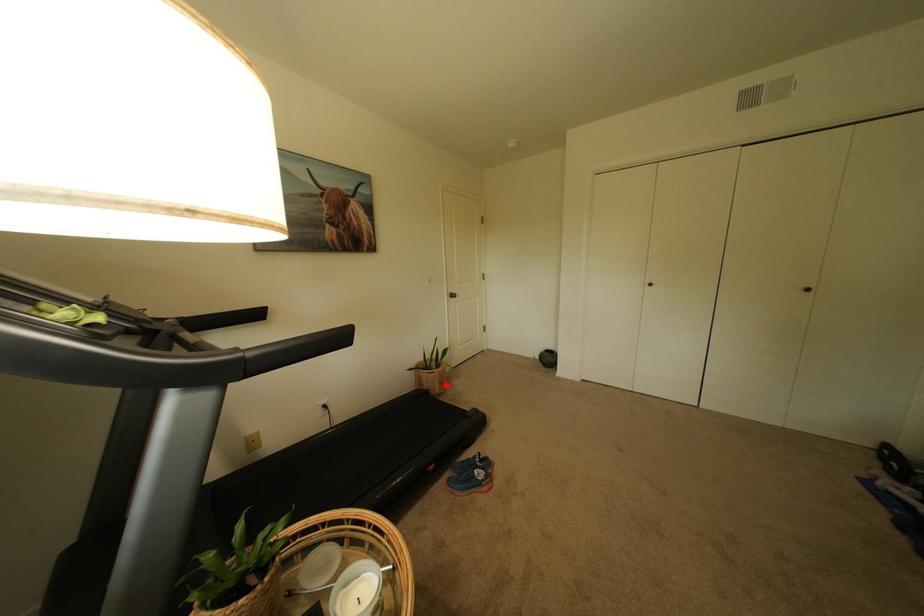
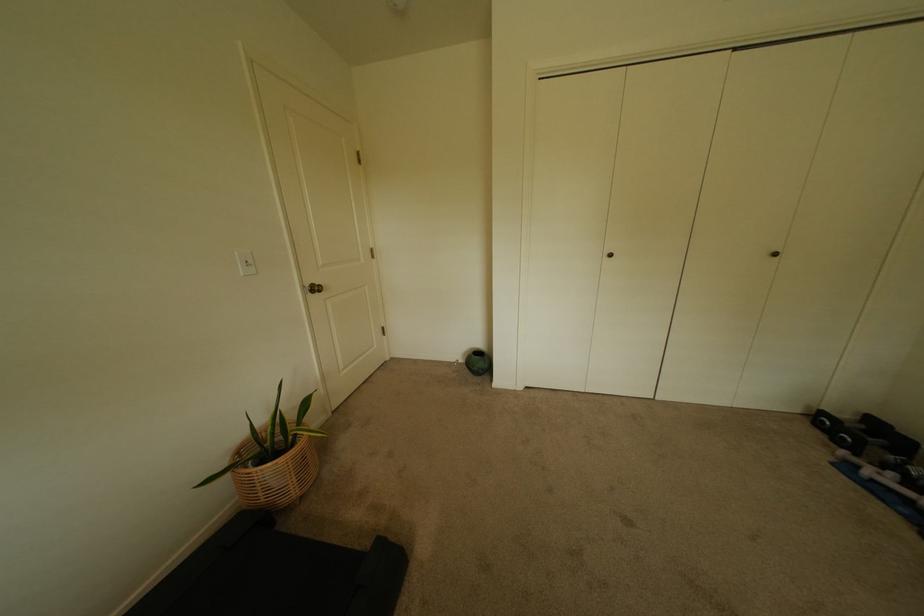
Question: I am providing you with two images of the same scene from different viewpoints. Image1 has a red point marked. In image2, the corresponding 3D location appears at what relative position? Reply with the corresponding letter.

Choices:
 (A) Closer
 (B) Farther

Answer: (A)